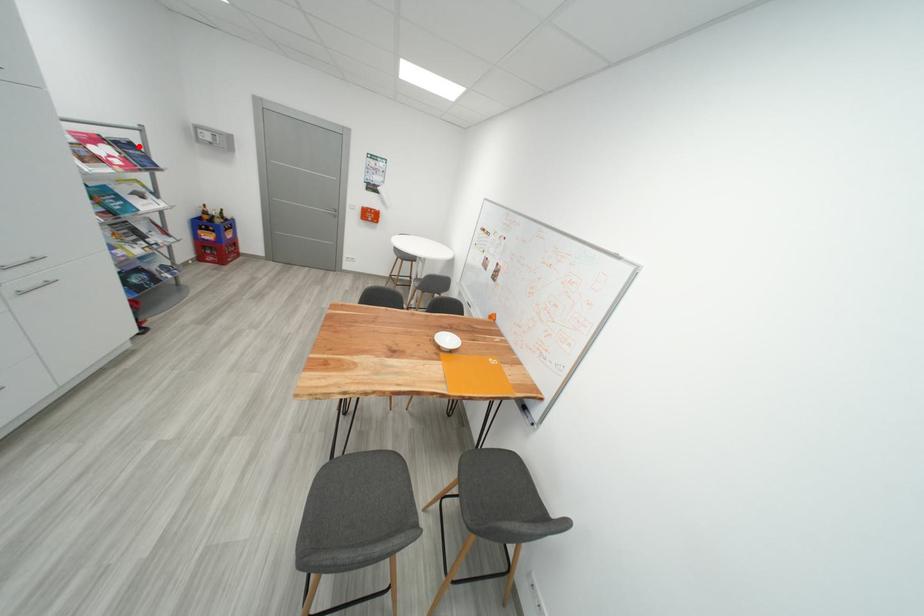
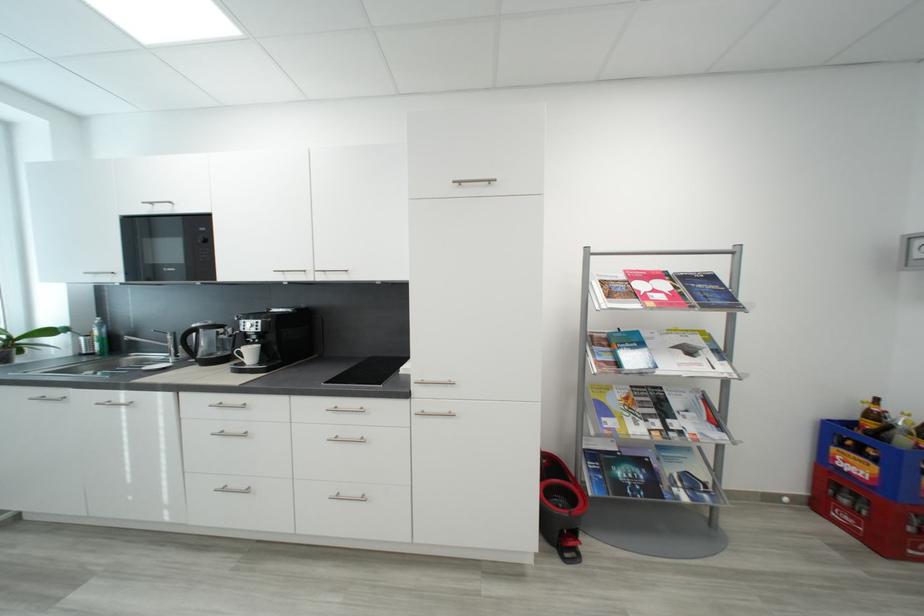
The point at the highlighted location is marked in the first image. Where is the corresponding point in the second image?

(718, 280)